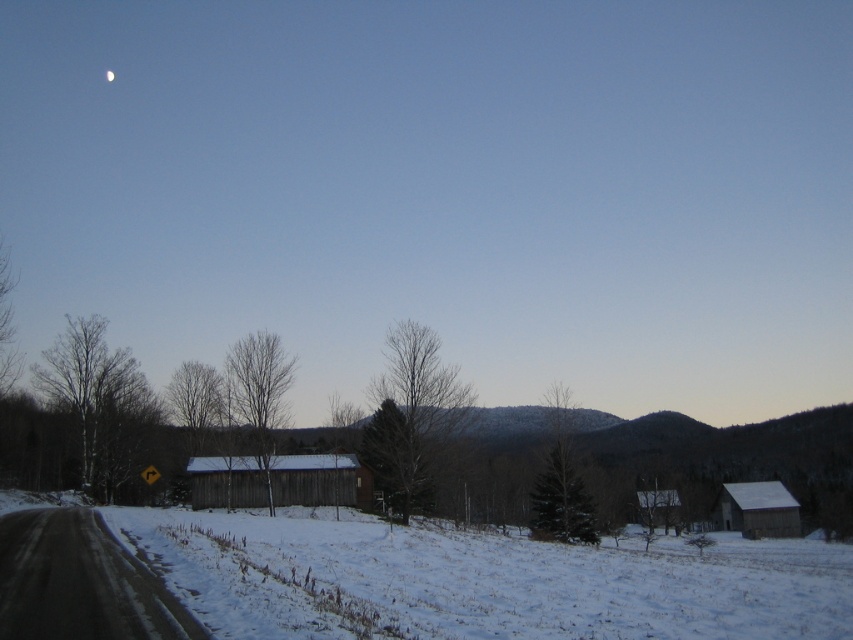
You are an astronomer observing the winter landscape. You notice the white fluffy snow at lower center and the white glossy moon at upper center. Which object appears bigger in the scene?

The white fluffy snow at lower center appears bigger than the white glossy moon at upper center in the scene.

Consider the image. You are a hiker planning to take a photo of the white fluffy snow at lower center and the white glossy moon at upper center. Which object is wider in the image?

The white fluffy snow at lower center is wider than the white glossy moon at upper center.